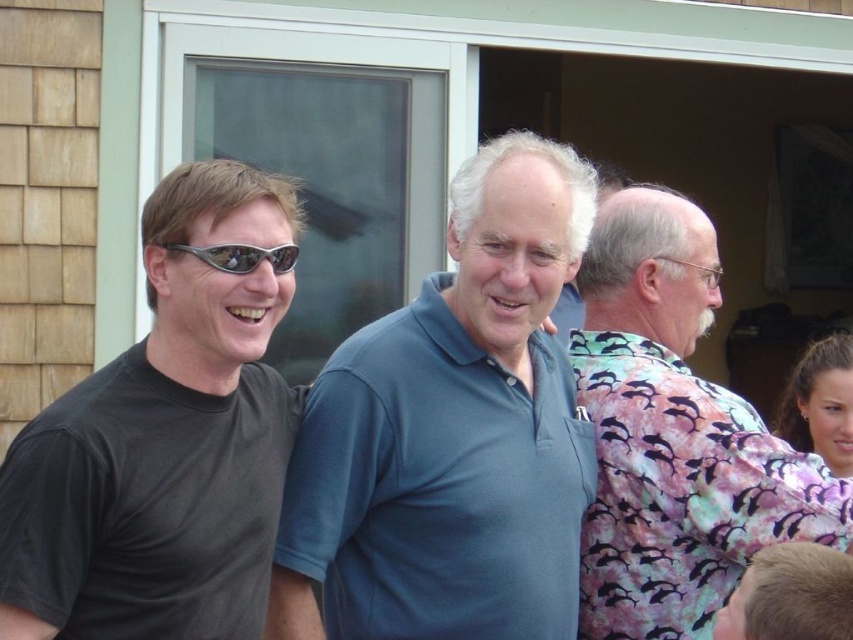
Question: Considering the real-world distances, which object is closest to the sunglasses at center?

Choices:
 (A) blue cotton polo shirt at center
 (B) pink dolphin-patterned shirt at right
 (C) black matte t-shirt at left

Answer: (C)

Question: Does blue cotton polo shirt at center appear over sunglasses at center?

Choices:
 (A) no
 (B) yes

Answer: (A)

Question: Is blue cotton polo shirt at center further to camera compared to pink dolphin-patterned shirt at right?

Choices:
 (A) no
 (B) yes

Answer: (A)

Question: Is pink dolphin-patterned shirt at right positioned behind sunglasses at center?

Choices:
 (A) no
 (B) yes

Answer: (B)

Question: Among these objects, which one is nearest to the camera?

Choices:
 (A) blue cotton polo shirt at center
 (B) black matte t-shirt at left

Answer: (B)

Question: Among these points, which one is farthest from the camera?

Choices:
 (A) (253, 253)
 (B) (155, 499)
 (C) (627, 310)
 (D) (570, 605)

Answer: (C)